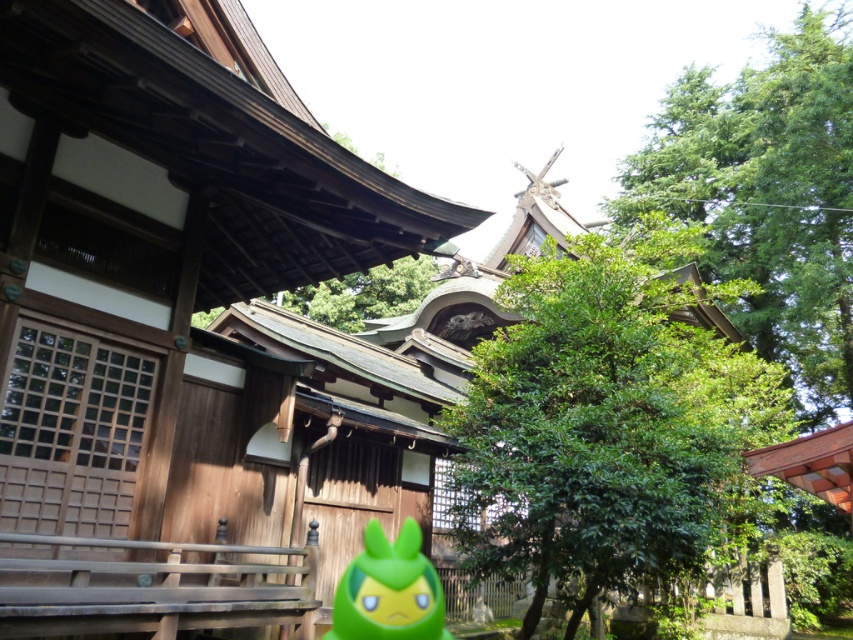
You are standing in front of the traditional Japanese shrine and notice a point marked at coordinates [605,422]. Based on the scene, what object does this point most likely indicate?

The point at coordinates [605,422] corresponds to the green leafy tree at center.

In the scene shown: You are visiting a traditional Japanese shrine and see the green leafy tree at upper right and the green rubber toy at center. Which object is taller?

The green leafy tree at upper right is much taller than the green rubber toy at center.

You are a visitor at the shrine and want to take a photo of the green leafy tree at upper right and the green rubber toy at center. Which object should you focus on first if you want to include both in the frame without moving the camera?

The green leafy tree at upper right is bigger than the green rubber toy at center, so you should focus on the green rubber toy at center first to ensure both fit in the frame.